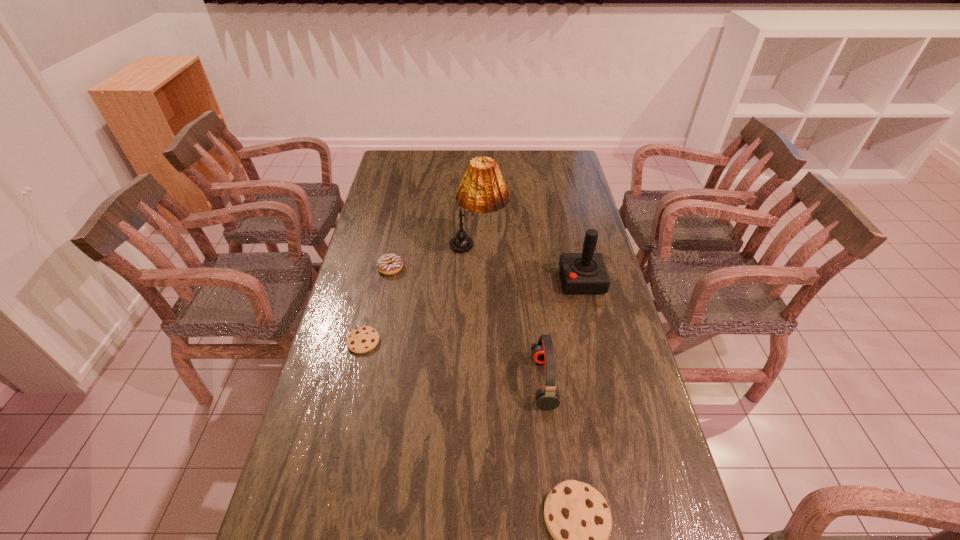
Locate an element on the screen. The width and height of the screenshot is (960, 540). spot to insert another cookie for uniform distribution is located at coordinates (454, 416).